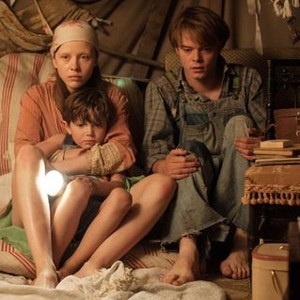
At what (x,y) coordinates should I click in order to perform the action: click on book on top of the pile. Please return your answer as a coordinate pair (x, y). Image resolution: width=300 pixels, height=300 pixels. Looking at the image, I should click on (276, 144).